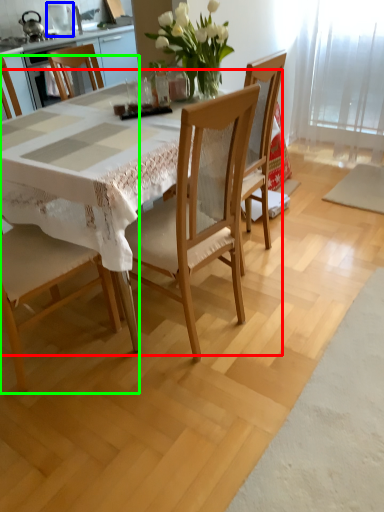
Question: Estimate the real-world distances between objects in this image. Which object is farther from round table (highlighted by a red box), appliance (highlighted by a blue box) or chair (highlighted by a green box)?

Choices:
 (A) appliance
 (B) chair

Answer: (A)